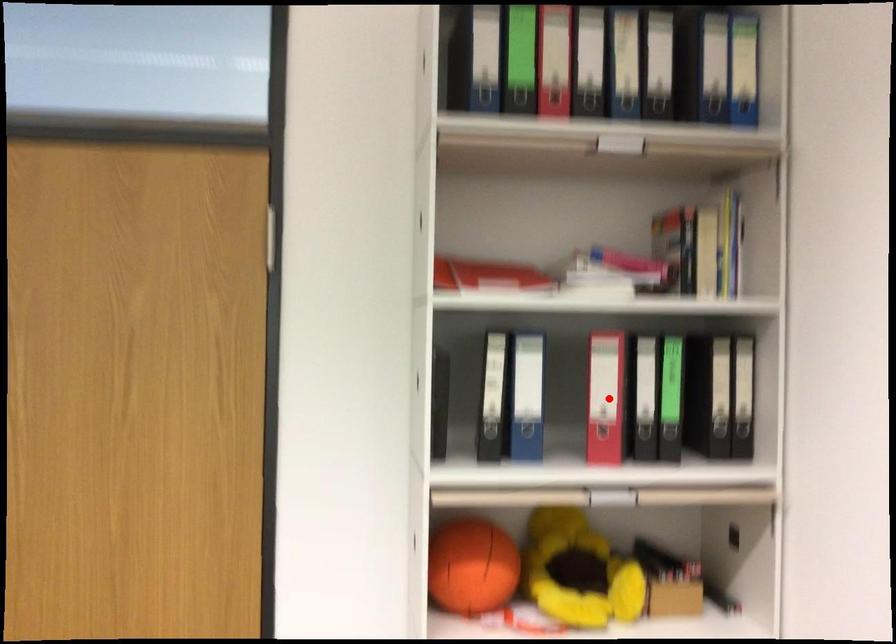
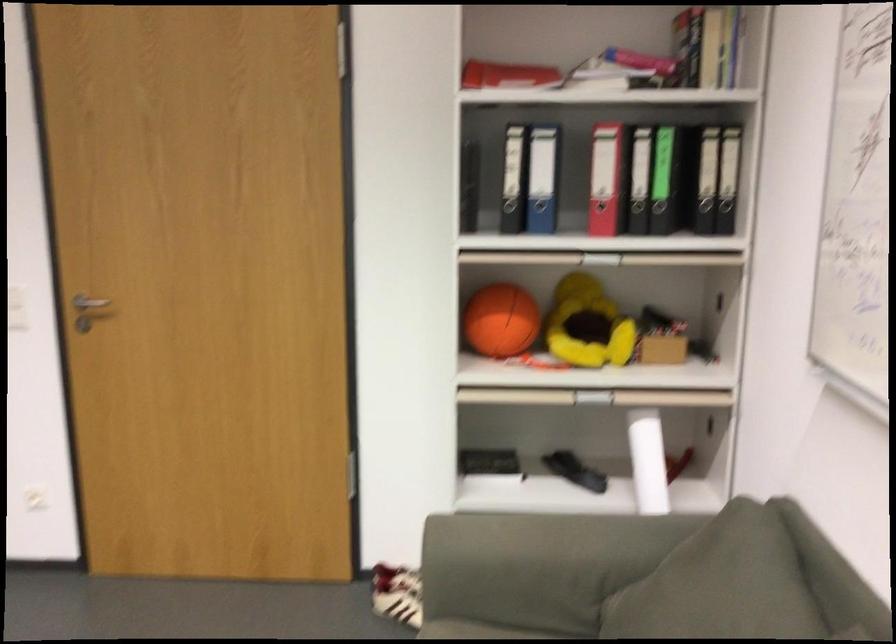
Question: A red point is marked in image1. In image2, is the corresponding 3D point closer to the camera or farther? Reply with the corresponding letter.

Choices:
 (A) The corresponding 3D point is closer.
 (B) The corresponding 3D point is farther.

Answer: (B)